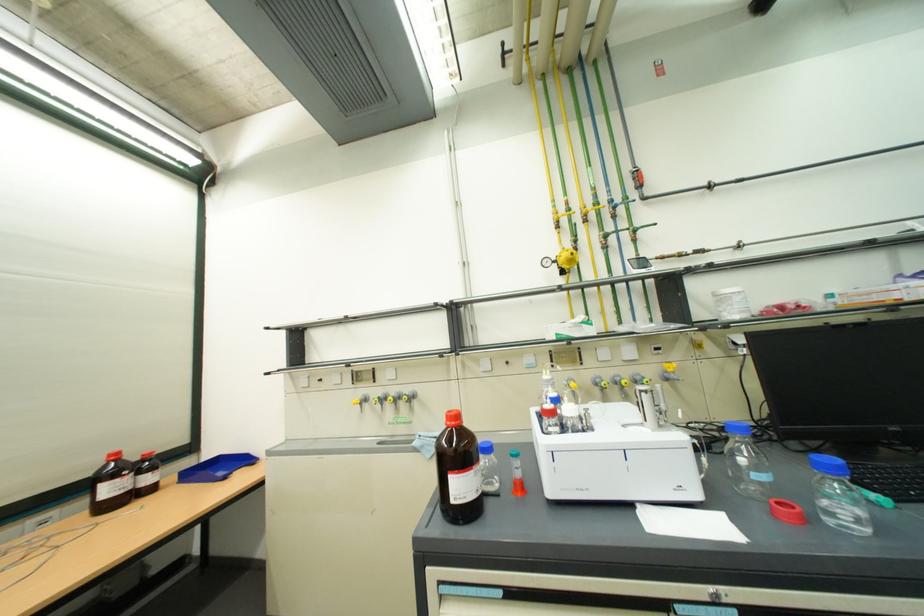
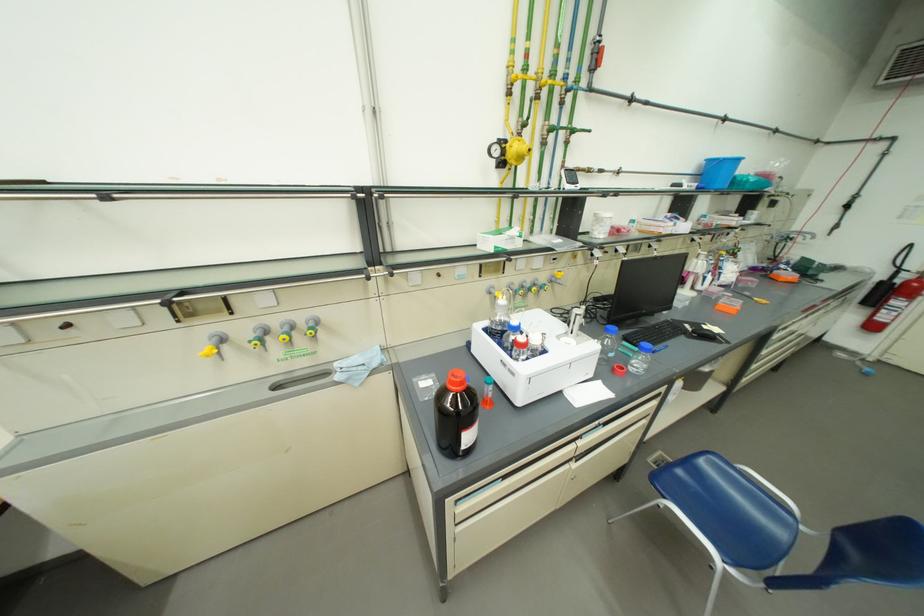
In the second image, find the point that corresponds to point (385, 403) in the first image.

(265, 346)